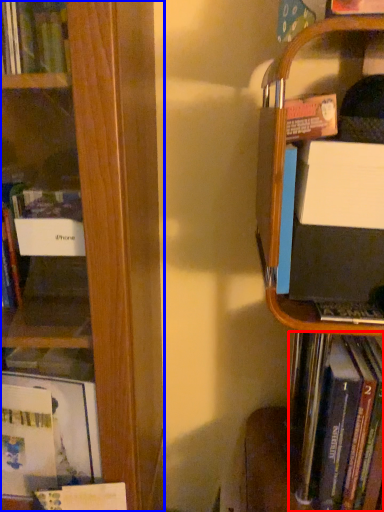
Question: Which object is further to the camera taking this photo, book (highlighted by a red box) or book (highlighted by a blue box)?

Choices:
 (A) book
 (B) book

Answer: (A)